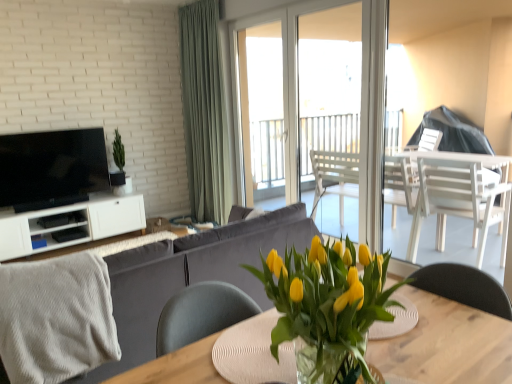
Question: From a real-world perspective, is transparent glass door at center physically located above or below translucent glass vase at center?

Choices:
 (A) above
 (B) below

Answer: (A)

Question: From their relative heights in the image, would you say transparent glass door at center is taller or shorter than translucent glass vase at center?

Choices:
 (A) short
 (B) tall

Answer: (B)

Question: Which is nearer to the green fabric curtain at center?

Choices:
 (A) matte black tv at left
 (B) wooden table at center
 (C) white matte cabinet at left
 (D) yellow matte tulips at center
 (E) textured gray blanket at lower left

Answer: (C)

Question: Based on their relative distances, which object is farther from the translucent glass vase at center?

Choices:
 (A) wooden table at center
 (B) textured gray blanket at lower left
 (C) matte black tv at left
 (D) yellow matte tulips at center
 (E) velvet grey couch at center

Answer: (C)